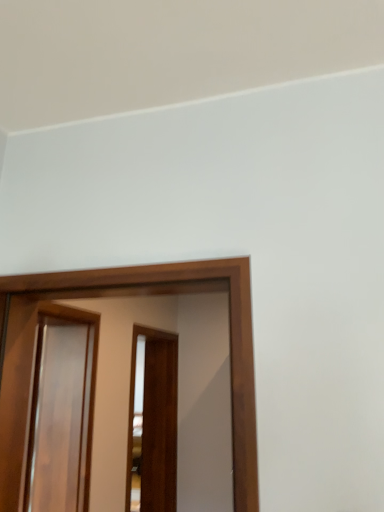
Question: Is glossy wood screen door at center, the 3th screen door when ordered from back to front, wider or thinner than brown wooden screen door at center, positioned as the third screen door in front-to-back order?

Choices:
 (A) wide
 (B) thin

Answer: (B)

Question: Is glossy wood screen door at center, the 3th screen door when ordered from back to front, to the left or to the right of brown wooden screen door at center, positioned as the third screen door in front-to-back order, in the image?

Choices:
 (A) left
 (B) right

Answer: (B)

Question: Estimate the real-world distances between objects in this image. Which object is closer to the brown wooden screen door at center, which appears as the 1th screen door when viewed from the back?

Choices:
 (A) glossy wood screen door at center, the 3th screen door when ordered from back to front
 (B) glossy wood screen door at left, which is the second screen door in back-to-front order

Answer: (B)

Question: Estimate the real-world distances between objects in this image. Which object is closer to the glossy wood screen door at center, which appears as the first screen door when viewed from the front?

Choices:
 (A) brown wooden screen door at center, positioned as the third screen door in front-to-back order
 (B) glossy wood screen door at left, which is the second screen door in back-to-front order

Answer: (B)